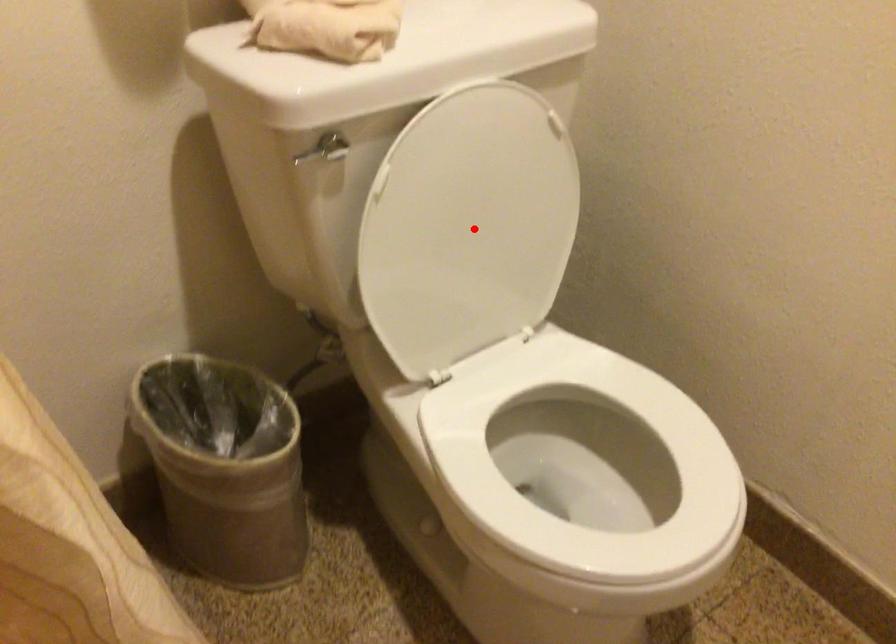
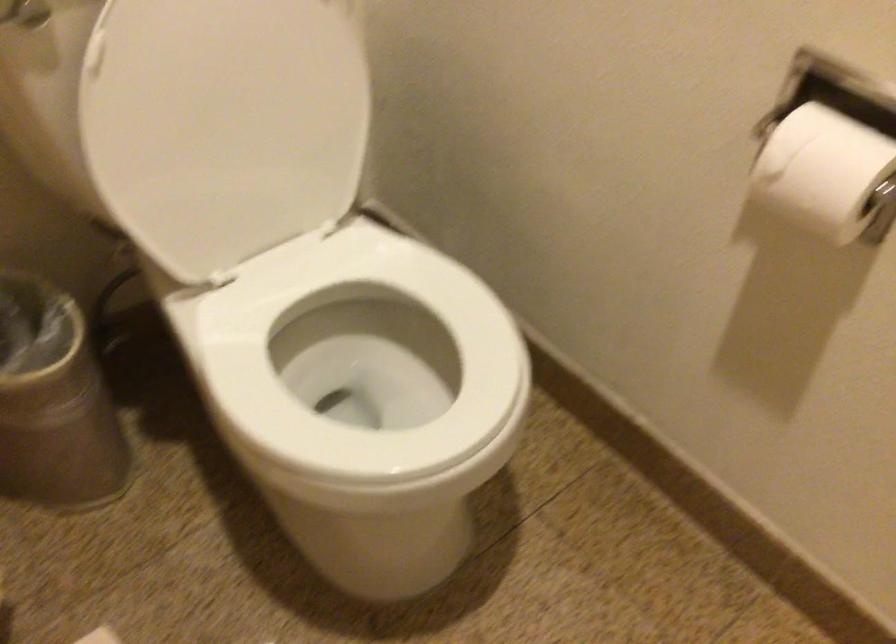
Find the pixel in the second image that matches the highlighted location in the first image.

(239, 114)